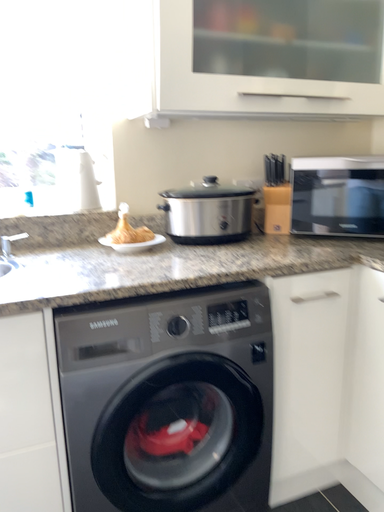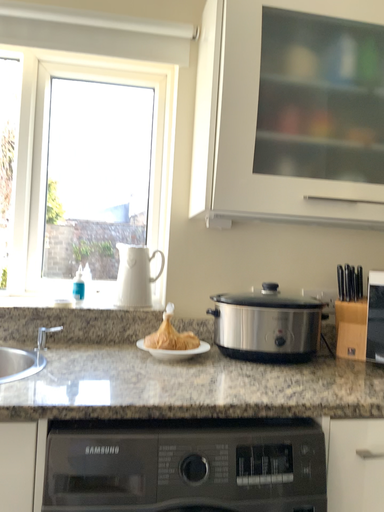
Question: How did the camera likely rotate when shooting the video?

Choices:
 (A) rotated upward
 (B) rotated downward

Answer: (A)